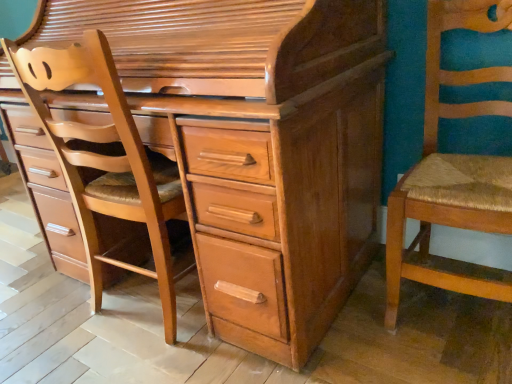
Image resolution: width=512 pixels, height=384 pixels. What do you see at coordinates (452, 168) in the screenshot? I see `wooden woven seat at right` at bounding box center [452, 168].

The height and width of the screenshot is (384, 512). Identify the location of light brown wood chest of drawers at center. pyautogui.click(x=257, y=145).

Where is `chest of drawers on the right of light brown wood chair at left`? Image resolution: width=512 pixels, height=384 pixels. chest of drawers on the right of light brown wood chair at left is located at coordinates (257, 145).

Is light brown wood chair at left completely or partially inside light brown wood chest of drawers at center?

Yes, light brown wood chair at left is a part of light brown wood chest of drawers at center.

Considering the relative sizes of light brown wood chest of drawers at center and light brown wood chair at left in the image provided, is light brown wood chest of drawers at center bigger than light brown wood chair at left?

Yes.

Is light brown wood chest of drawers at center beside light brown wood chair at left?

No, light brown wood chest of drawers at center is not beside light brown wood chair at left.

Is light brown wood chair at left outside of wooden woven seat at right?

Yes, light brown wood chair at left is not within wooden woven seat at right.

Are light brown wood chair at left and wooden woven seat at right located far from each other?

No, light brown wood chair at left is not far away from wooden woven seat at right.

Who is more distant, light brown wood chair at left or wooden woven seat at right?

light brown wood chair at left is more distant.

How much distance is there between light brown wood chair at left and wooden woven seat at right?

light brown wood chair at left and wooden woven seat at right are 32.71 inches apart from each other.

Is point (438, 195) positioned before point (353, 205)?

Yes.

Is wooden woven seat at right directly adjacent to light brown wood chest of drawers at center?

They are not placed beside each other.

Is wooden woven seat at right looking in the opposite direction of light brown wood chest of drawers at center?

wooden woven seat at right does not have its back to light brown wood chest of drawers at center.

Is wooden woven seat at right not near light brown wood chair at left?

Actually, wooden woven seat at right and light brown wood chair at left are a little close together.

Between wooden woven seat at right and light brown wood chair at left, which one has smaller width?

light brown wood chair at left is thinner.

From the image's perspective, does wooden woven seat at right appear lower than light brown wood chair at left?

Actually, wooden woven seat at right appears above light brown wood chair at left in the image.

Considering the positions of objects wooden woven seat at right and light brown wood chair at left in the image provided, who is more to the left, wooden woven seat at right or light brown wood chair at left?

Positioned to the left is light brown wood chair at left.

Is light brown wood chair at left oriented towards light brown wood chest of drawers at center?

Yes.

Do you think light brown wood chair at left is within light brown wood chest of drawers at center, or outside of it?

light brown wood chair at left lies within the bounds of light brown wood chest of drawers at center.

Considering the relative sizes of light brown wood chair at left and light brown wood chest of drawers at center in the image provided, is light brown wood chair at left thinner than light brown wood chest of drawers at center?

Yes, light brown wood chair at left is thinner than light brown wood chest of drawers at center.

Would you consider light brown wood chair at left to be distant from light brown wood chest of drawers at center?

No, light brown wood chair at left is not far away from light brown wood chest of drawers at center.

From the image's perspective, is light brown wood chest of drawers at center positioned above or below wooden woven seat at right?

light brown wood chest of drawers at center is situated higher than wooden woven seat at right in the image.

In the image, is light brown wood chest of drawers at center positioned in front of or behind wooden woven seat at right?

In the image, light brown wood chest of drawers at center appears in front of wooden woven seat at right.

Could wooden woven seat at right be considered to be inside light brown wood chest of drawers at center?

That's incorrect, wooden woven seat at right is not inside light brown wood chest of drawers at center.

Does light brown wood chest of drawers at center touch wooden woven seat at right?

No, light brown wood chest of drawers at center is not making contact with wooden woven seat at right.

Image resolution: width=512 pixels, height=384 pixels. What are the coordinates of `armchair behind the light brown wood chest of drawers at center` in the screenshot? It's located at (106, 161).

Find the location of a particular element. chair that appears below the light brown wood chair at left (from a real-world perspective) is located at coordinates (452, 168).

Consider the image. When comparing their distances from wooden woven seat at right, does light brown wood chair at left or light brown wood chest of drawers at center seem further?

light brown wood chair at left is further to wooden woven seat at right.

When comparing their distances from light brown wood chest of drawers at center, does wooden woven seat at right or light brown wood chair at left seem further?

Based on the image, wooden woven seat at right appears to be further to light brown wood chest of drawers at center.

When comparing their distances from light brown wood chest of drawers at center, does light brown wood chair at left or wooden woven seat at right seem further?

Among the two, wooden woven seat at right is located further to light brown wood chest of drawers at center.

Looking at this image, based on their spatial positions, is light brown wood chest of drawers at center or light brown wood chair at left closer to wooden woven seat at right?

light brown wood chest of drawers at center.

Based on their spatial positions, is light brown wood chest of drawers at center or wooden woven seat at right closer to light brown wood chair at left?

Among the two, light brown wood chest of drawers at center is located nearer to light brown wood chair at left.

Based on their spatial positions, is wooden woven seat at right or light brown wood chest of drawers at center closer to light brown wood chair at left?

light brown wood chest of drawers at center lies closer to light brown wood chair at left than the other object.

Where is `chest of drawers between light brown wood chair at left and wooden woven seat at right from left to right`? chest of drawers between light brown wood chair at left and wooden woven seat at right from left to right is located at coordinates [x=257, y=145].